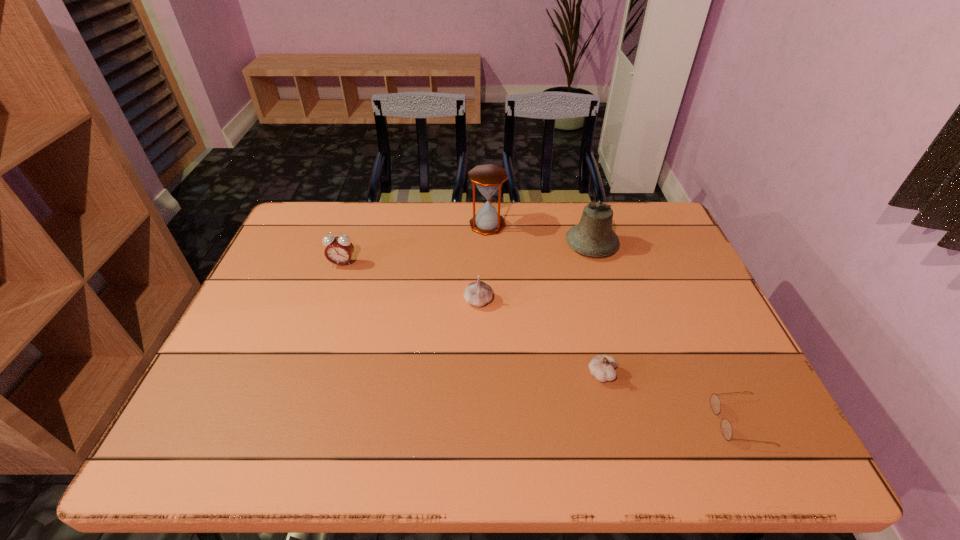
Locate which object ranks second in proximity to the leftmost object. Please provide its 2D coordinates. Your answer should be formatted as a tuple, i.e. [(x, y)], where the tuple contains the x and y coordinates of a point satisfying the conditions above.

[(488, 178)]

You are a GUI agent. You are given a task and a screenshot of the screen. Output one action in this format:
    pyautogui.click(x=<x>, y=<y>)
    Task: Click on the vacant space that satisfies the following two spatial constraints: 1. on the front side of the right garlic; 2. on the left side of the hourglass
    The height and width of the screenshot is (540, 960).
    Given the screenshot: What is the action you would take?
    pyautogui.click(x=491, y=374)

Identify the location of vacant space that satisfies the following two spatial constraints: 1. on the clock face of the leftmost object; 2. on the right side of the left garlic. (329, 301).